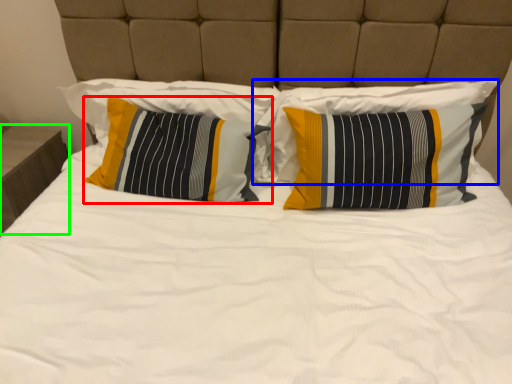
Question: Which object is positioned closest to pillow (highlighted by a red box)? Select from pillow (highlighted by a blue box) and nightstand (highlighted by a green box).

Choices:
 (A) pillow
 (B) nightstand

Answer: (A)